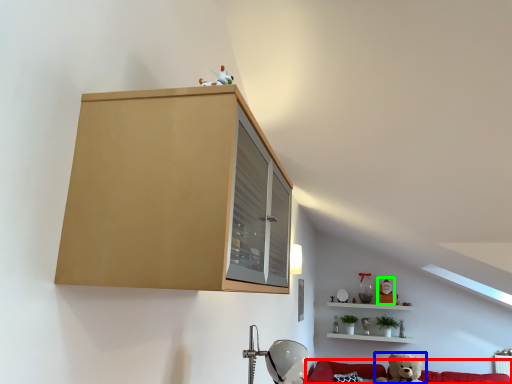
Question: Estimate the real-world distances between objects in this image. Which object is closer to couch (highlighted by a red box), toy (highlighted by a blue box) or toy (highlighted by a green box)?

Choices:
 (A) toy
 (B) toy

Answer: (A)